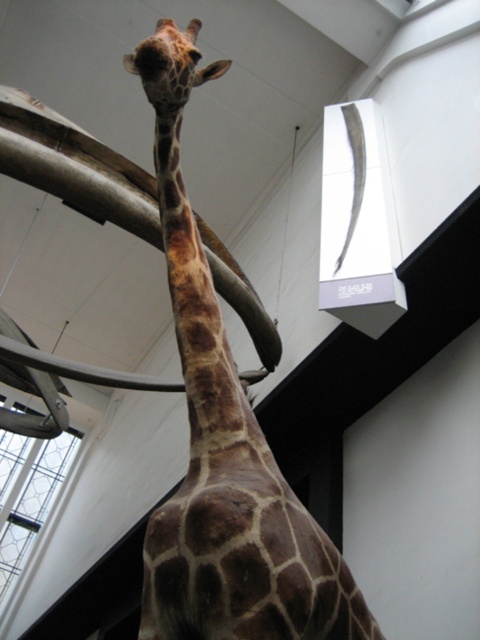
Is brown textured neck at center positioned behind brown spotted giraffe head at upper center?

No, brown textured neck at center is in front of brown spotted giraffe head at upper center.

Between point (240, 416) and point (162, 100), which one is positioned behind?

The point (162, 100) is more distant.

Identify the location of brown textured neck at center. This screenshot has width=480, height=640. (194, 305).

Looking at this image, between matte gray beam at upper center and brown textured neck at center, which one appears on the right side from the viewer's perspective?

brown textured neck at center is more to the right.

Between point (274, 332) and point (217, 344), which one is positioned in front?

Point (217, 344) is more forward.

Locate an element on the screen. matte gray beam at upper center is located at coordinates (74, 166).

Can you confirm if matte gray beam at upper center is positioned below brown spotted giraffe head at upper center?

Yes.

What do you see at coordinates (74, 166) in the screenshot? I see `matte gray beam at upper center` at bounding box center [74, 166].

Who is more distant from viewer, (110, 164) or (227, 58)?

Positioned behind is point (227, 58).

At what (x,y) coordinates should I click in order to perform the action: click on matte gray beam at upper center. Please return your answer as a coordinate pair (x, y). The width and height of the screenshot is (480, 640). Looking at the image, I should click on (74, 166).